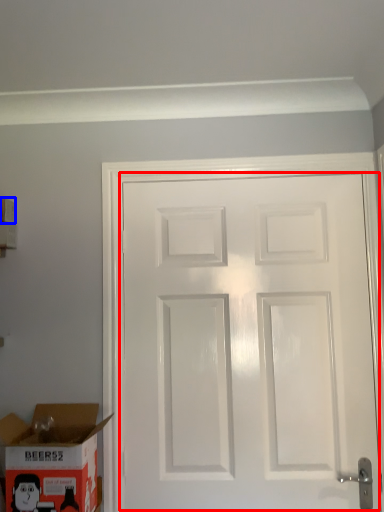
Question: Which point is closer to the camera, door (highlighted by a red box) or box (highlighted by a blue box)?

Choices:
 (A) door
 (B) box

Answer: (A)